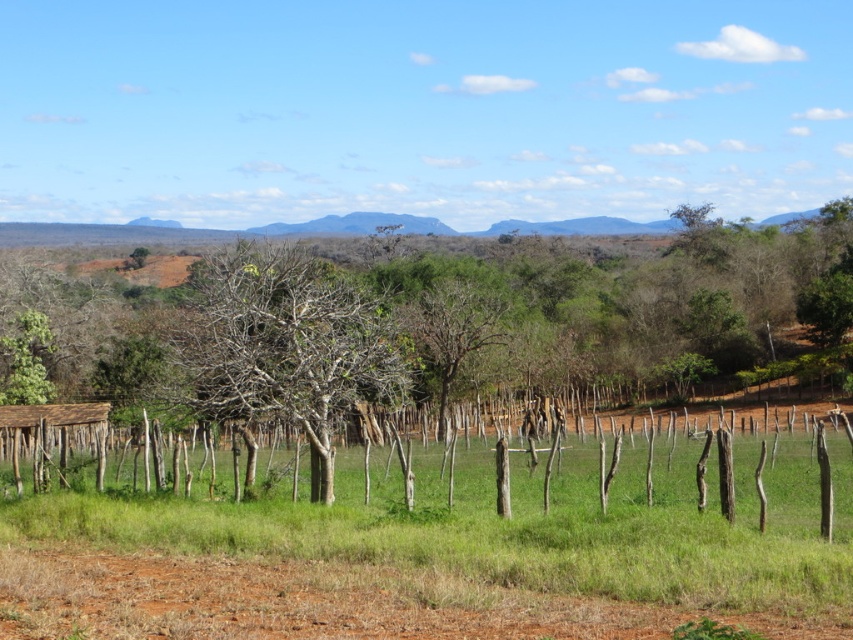
Is brown dirt track at lower center wider than brown wooden hut at lower left?

In fact, brown dirt track at lower center might be narrower than brown wooden hut at lower left.

Between point (335, 598) and point (33, 420), which one is positioned behind?

The point (33, 420) is more distant.

Where is `brown dirt track at lower center`? Image resolution: width=853 pixels, height=640 pixels. brown dirt track at lower center is located at coordinates (320, 602).

Who is shorter, bare wood tree at center or brown wooden hut at lower left?

brown wooden hut at lower left is shorter.

Can you confirm if bare wood tree at center is positioned to the right of brown wooden hut at lower left?

Yes, bare wood tree at center is to the right of brown wooden hut at lower left.

This screenshot has height=640, width=853. Describe the element at coordinates (283, 342) in the screenshot. I see `bare wood tree at center` at that location.

This screenshot has height=640, width=853. What are the coordinates of `bare wood tree at center` in the screenshot? It's located at (283, 342).

Can you confirm if brown wooden fence at center is positioned below brown wooden hut at lower left?

Correct, brown wooden fence at center is located below brown wooden hut at lower left.

Does brown wooden fence at center appear over brown wooden hut at lower left?

Incorrect, brown wooden fence at center is not positioned above brown wooden hut at lower left.

Where is `brown wooden fence at center`? The width and height of the screenshot is (853, 640). brown wooden fence at center is located at coordinates pos(485,493).